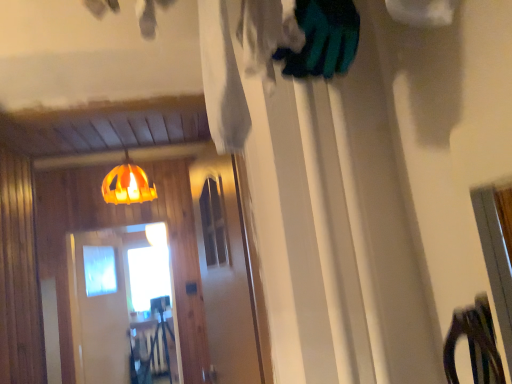
Question: Which is correct: orange fabric lampshade at upper center is inside transparent glass screen door at center, which is counted as the 2th screen door, starting from the back, or outside of it?

Choices:
 (A) outside
 (B) inside

Answer: (A)

Question: Considering their positions, is orange fabric lampshade at upper center located in front of or behind transparent glass screen door at center, the first screen door in the right-to-left sequence?

Choices:
 (A) behind
 (B) front

Answer: (A)

Question: Based on their relative distances, which object is nearer to the transparent plastic screen door at center, which is counted as the 1th screen door, starting from the left?

Choices:
 (A) transparent glass screen door at center, which is counted as the 2th screen door, starting from the back
 (B) orange fabric lampshade at upper center

Answer: (B)

Question: Which of these objects is positioned closest to the transparent plastic screen door at center, which is the 2th screen door in front-to-back order?

Choices:
 (A) transparent glass screen door at center, acting as the second screen door starting from the left
 (B) orange fabric lampshade at upper center

Answer: (B)